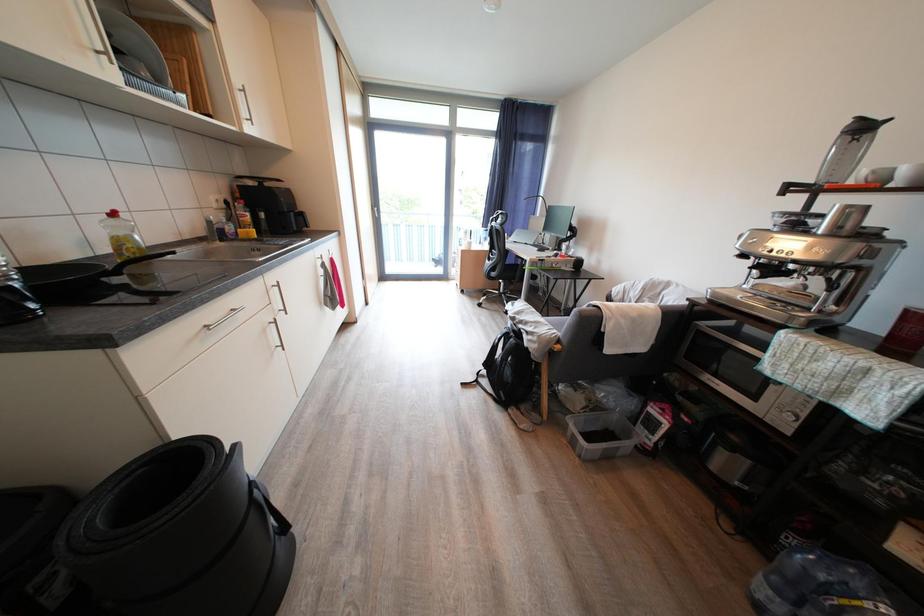
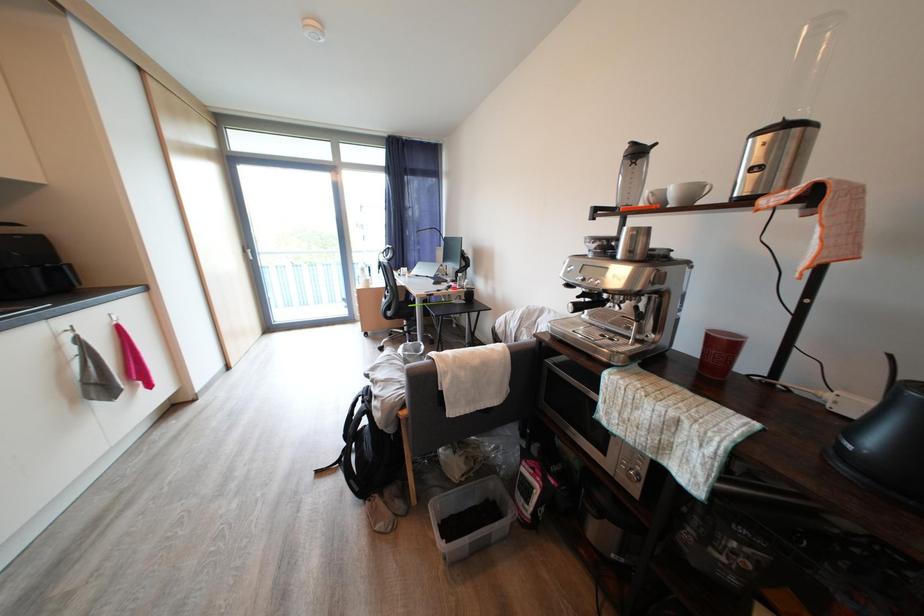
Question: How did the camera likely rotate?

Choices:
 (A) Left
 (B) Right
 (C) Up
 (D) Down

Answer: (B)